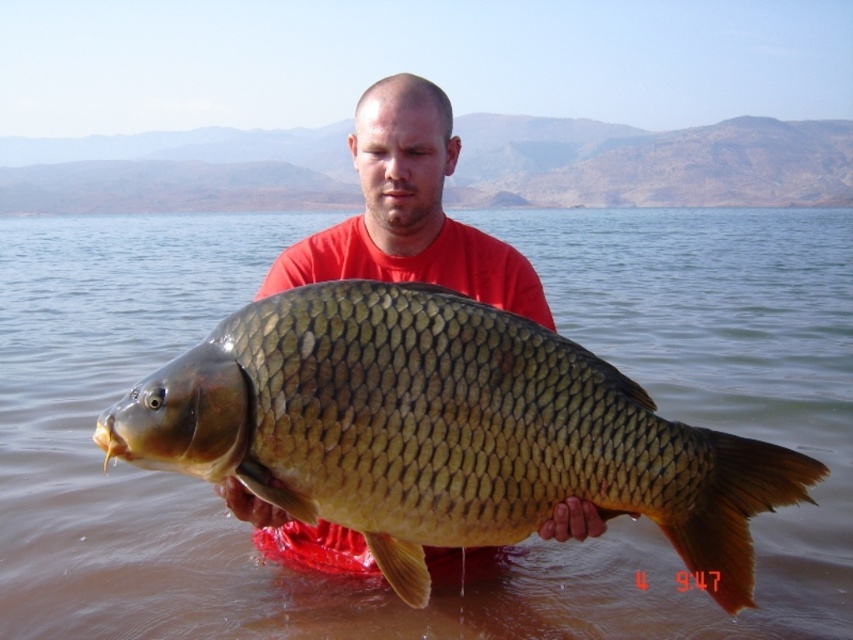
You are a wildlife photographer aiming to capture a closeup of both the shiny gold scales at center and the matte gold fish at center in the scene. Given that your camera lens has a maximum focus range of 30 inches, can you fit both subjects within the frame without moving your position?

The shiny gold scales at center and matte gold fish at center are 30.14 inches apart, which exceeds the camera lens maximum focus range of 30 inches. Therefore, you cannot fit both subjects within the frame without moving your position.

You are a photographer trying to capture the shiny gold scales at center and the matte gold fish at center in a single frame. Since the camera can only focus on one object at a time, which object should you choose to ensure the smaller one is in focus? Please explain your reasoning.

The shiny gold scales at center has a smaller size compared to the matte gold fish at center. To ensure the smaller object is in focus, you should focus on the shiny gold scales at center because smaller objects often require precise focus to capture details clearly.